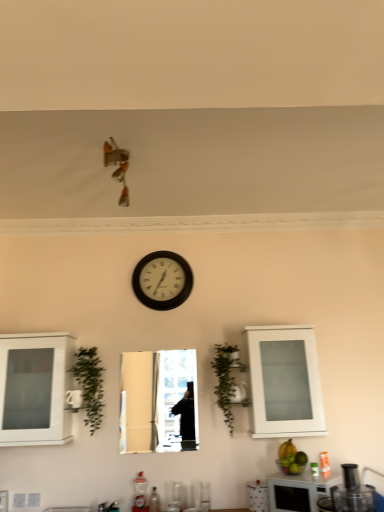
Question: Considering the positions of point (307, 476) and point (354, 490), is point (307, 476) closer or farther from the camera than point (354, 490)?

Choices:
 (A) closer
 (B) farther

Answer: (B)

Question: From a real-world perspective, is black matte microwave at lower right, the 1th appliance viewed from the back, physically located above or below black plastic food processor at lower right, acting as the 2th appliance starting from the back?

Choices:
 (A) above
 (B) below

Answer: (B)

Question: Which object is the farthest from the white glass cabinet at lower right, the 2th cabinetry viewed from the left?

Choices:
 (A) yellow matte bananas at lower right
 (B) white matte cabinet at left, the 2th cabinetry when ordered from right to left
 (C) green leafy plant at left, which is counted as the 2th plant, starting from the right
 (D) green leafy plant at center, placed as the second plant when sorted from left to right
 (E) wooden wall clock at center

Answer: (B)

Question: Which is nearer to the black matte microwave at lower right, the second appliance viewed from the front?

Choices:
 (A) metallic reflective mirror at center
 (B) green leafy plant at left, which is counted as the 2th plant, starting from the right
 (C) white glass cabinet at lower right, arranged as the 1th cabinetry when viewed from the right
 (D) white matte cabinet at left, the 2th cabinetry when ordered from right to left
 (E) wooden wall clock at center

Answer: (C)